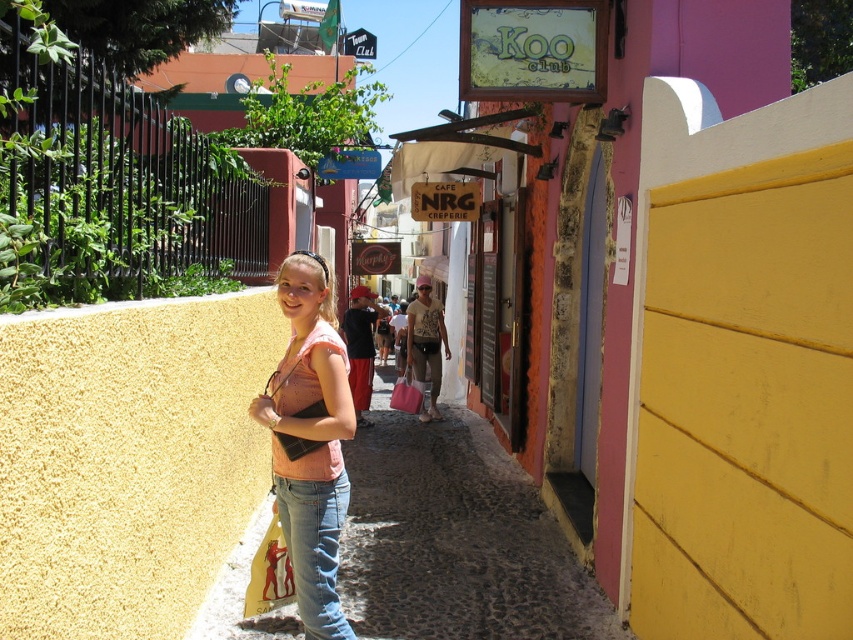
Question: Can you confirm if pink matte shirt at center is positioned to the right of pink fabric shopping bag at center?

Choices:
 (A) yes
 (B) no

Answer: (B)

Question: Which of the following is the closest to the observer?

Choices:
 (A) (277, 492)
 (B) (408, 378)

Answer: (A)

Question: Does pink matte shirt at center have a larger size compared to yellow fabric shopping bag at center?

Choices:
 (A) no
 (B) yes

Answer: (B)

Question: Does pink matte shirt at center appear on the right side of pink fabric shopping bag at center?

Choices:
 (A) yes
 (B) no

Answer: (B)

Question: Which of the following is the closest to the observer?

Choices:
 (A) pink matte shirt at center
 (B) denim jeans at center

Answer: (A)

Question: Considering the real-world distances, which object is farthest from the pink fabric vest at center?

Choices:
 (A) denim jeans at center
 (B) pink fabric shopping bag at center

Answer: (B)